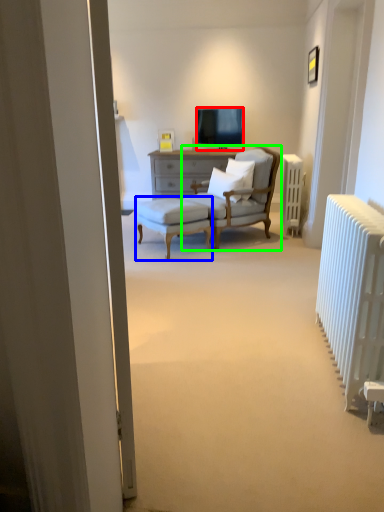
Question: Estimate the real-world distances between objects in this image. Which object is closer to television (highlighted by a red box), stool (highlighted by a blue box) or chair (highlighted by a green box)?

Choices:
 (A) stool
 (B) chair

Answer: (B)